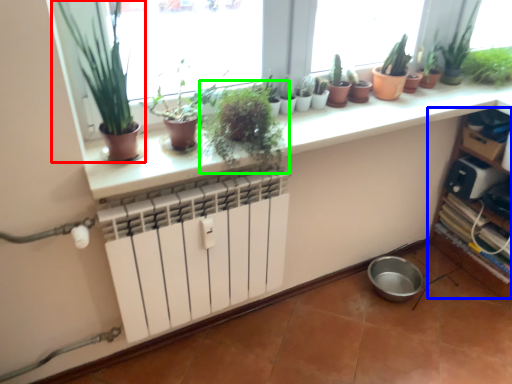
Question: Which is farther away from houseplant (highlighted by a red box)? shelf (highlighted by a blue box) or houseplant (highlighted by a green box)?

Choices:
 (A) shelf
 (B) houseplant

Answer: (A)